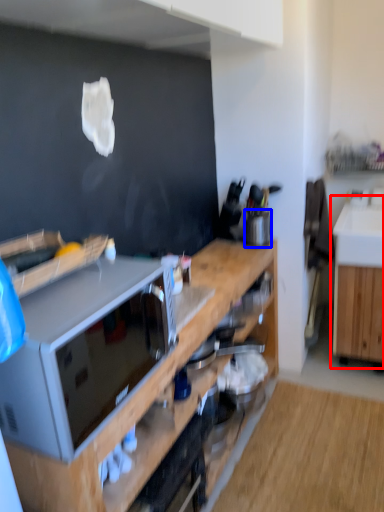
Question: Which of the following is the closest to the observer, cabinetry (highlighted by a red box) or appliance (highlighted by a blue box)?

Choices:
 (A) cabinetry
 (B) appliance

Answer: (B)